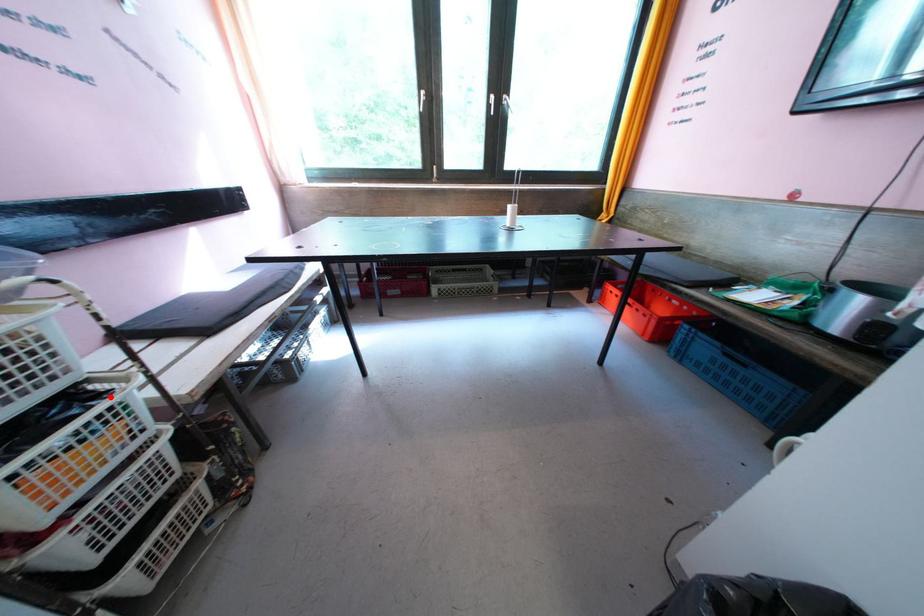
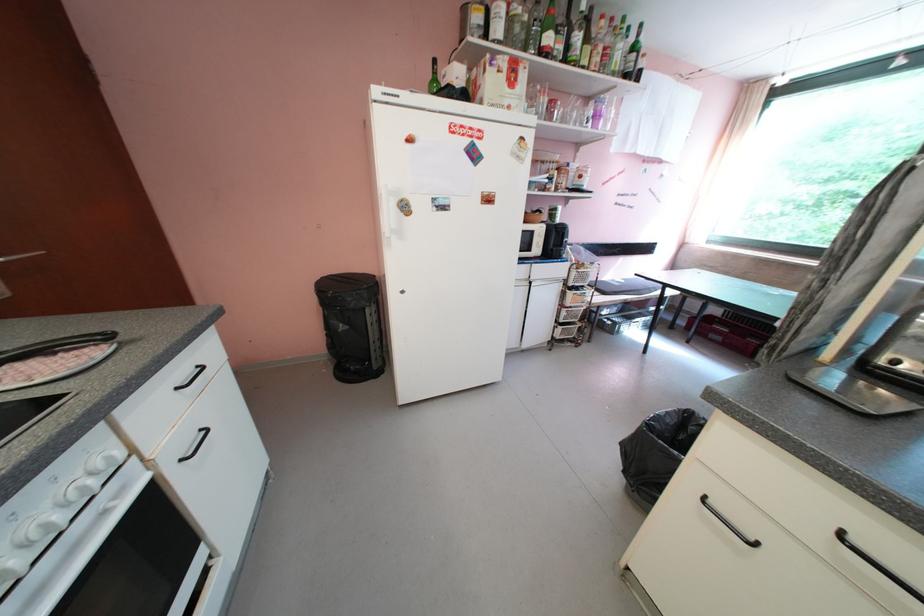
Locate, in the second image, the point that corresponds to the highlighted location in the first image.

(593, 293)